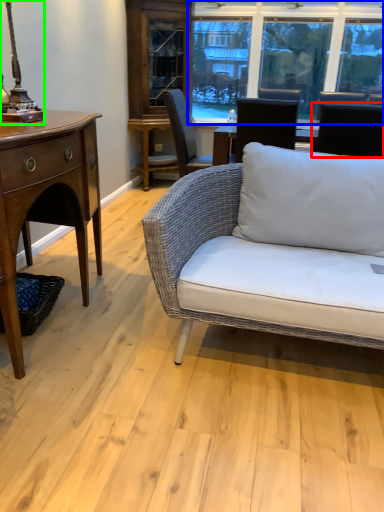
Question: Which object is the farthest from chair (highlighted by a red box)? Choose among these: window (highlighted by a blue box) or table lamp (highlighted by a green box).

Choices:
 (A) window
 (B) table lamp

Answer: (A)